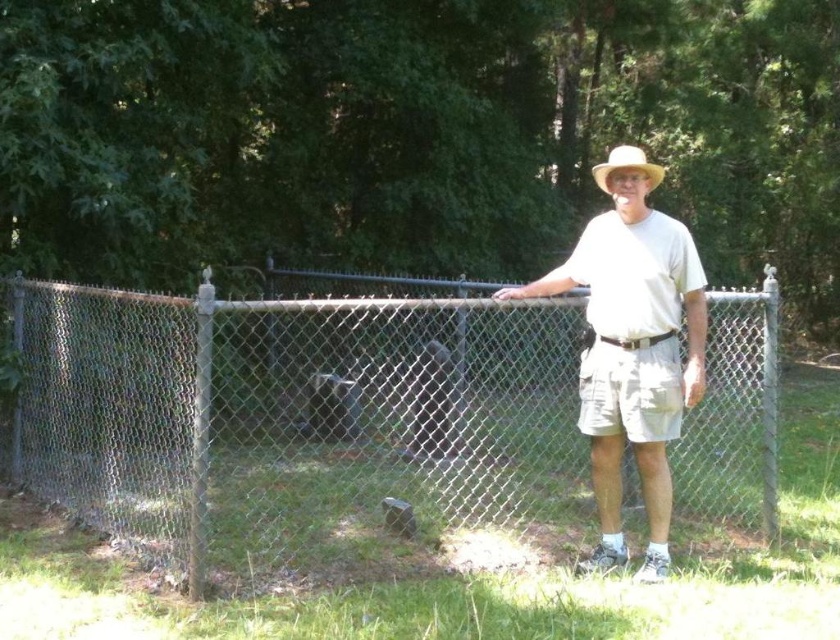
You are a photographer trying to capture a portrait of the man in the scene. You want to ensure that both the white cotton shirt at center and the light brown straw hat at center are clearly visible in the photo. Based on their positions, which one should you focus on first to ensure proper depth of field?

The white cotton shirt at center is below the light brown straw hat at center. To ensure proper depth of field, focus on the light brown straw hat at center first since it is closer to the camera, ensuring both elements remain in focus.